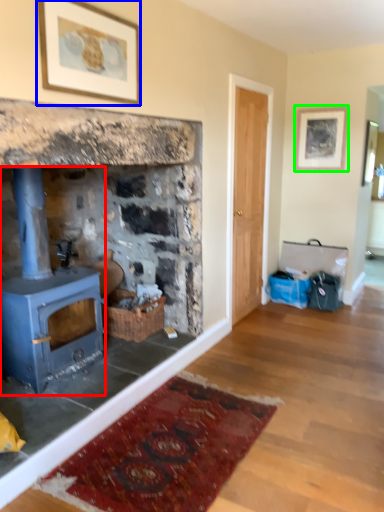
Question: Which object is positioned closest to wood burning stove (highlighted by a red box)? Select from picture frame (highlighted by a blue box) and picture frame (highlighted by a green box).

Choices:
 (A) picture frame
 (B) picture frame

Answer: (A)